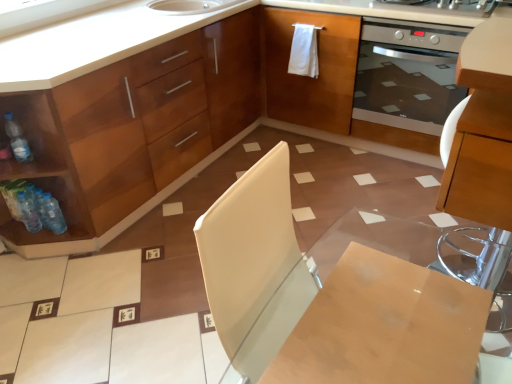
Question: Considering their positions, is translucent plastic bottle at lower left, which is the 3th bottle from top to bottom, located in front of or behind wooden table at center?

Choices:
 (A) behind
 (B) front

Answer: (A)

Question: Is translucent plastic bottle at lower left, the first bottle from the bottom, situated inside wooden table at center or outside?

Choices:
 (A) outside
 (B) inside

Answer: (A)

Question: Estimate the real-world distances between objects in this image. Which object is farther from the stainless steel oven at upper right?

Choices:
 (A) wooden table at center
 (B) clear plastic bottle at left, the 1th bottle in the top-to-bottom sequence
 (C) satin silver oven at right
 (D) translucent plastic bottles at lower left, the second bottle positioned from the top
 (E) translucent plastic bottle at lower left, the first bottle from the bottom

Answer: (D)

Question: Estimate the real-world distances between objects in this image. Which object is closer to the matte wood cabinet at center?

Choices:
 (A) translucent plastic bottle at lower left, which is the 3th bottle from top to bottom
 (B) stainless steel oven at upper right
 (C) clear plastic bottle at left, the 1th bottle in the top-to-bottom sequence
 (D) wooden table at center
 (E) satin silver oven at right

Answer: (E)